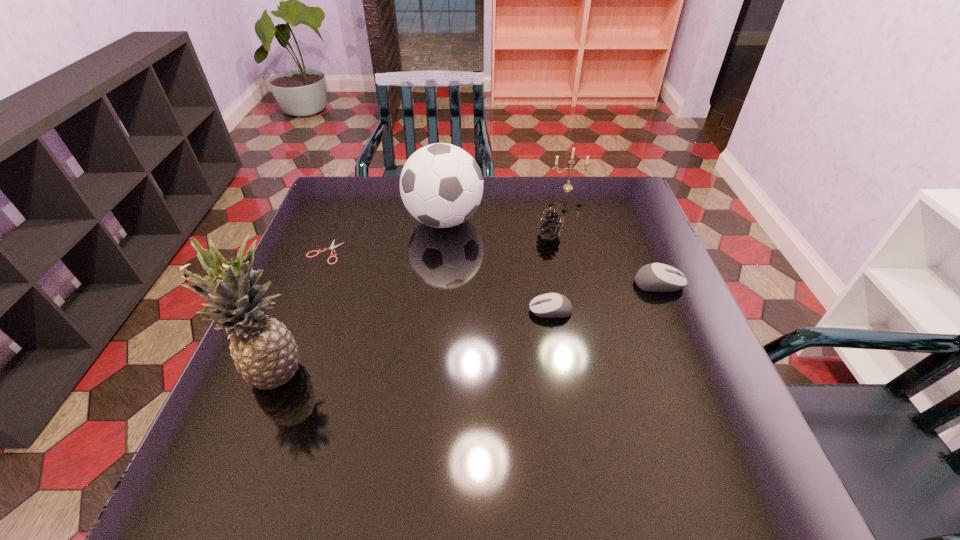
What are the coordinates of `the tallest object` in the screenshot? It's located at (265, 353).

Where is `pineapple`? The height and width of the screenshot is (540, 960). pineapple is located at coordinates (265, 353).

The width and height of the screenshot is (960, 540). In order to click on vacant area situated 0.400m on the wheel side of the nearer computer equipment in this screenshot , I will do `click(359, 310)`.

Find the location of `vacant region located on the wheel side of the nearer computer equipment`. vacant region located on the wheel side of the nearer computer equipment is located at coordinates (406, 310).

Where is `vacant space located on the wheel side of the nearer computer equipment`? vacant space located on the wheel side of the nearer computer equipment is located at coordinates (466, 310).

Where is `vacant region located 0.390m on the left of the candle`? The width and height of the screenshot is (960, 540). vacant region located 0.390m on the left of the candle is located at coordinates (430, 188).

Find the location of a particular element. The width and height of the screenshot is (960, 540). free spot located 0.070m on the front of the sixth shortest object is located at coordinates (440, 262).

Locate an element on the screen. free space located on the front of the shortest object is located at coordinates (310, 289).

At what (x,y) coordinates should I click in order to perform the action: click on free space located on the front of the pinecone. Please return your answer as a coordinate pair (x, y). Looking at the image, I should click on (554, 259).

You are a GUI agent. You are given a task and a screenshot of the screen. Output one action in this format:
    pyautogui.click(x=<x>, y=<y>)
    Task: Click on the vacant space situated on the right of the nearest object
    
    Given the screenshot: What is the action you would take?
    pyautogui.click(x=396, y=371)